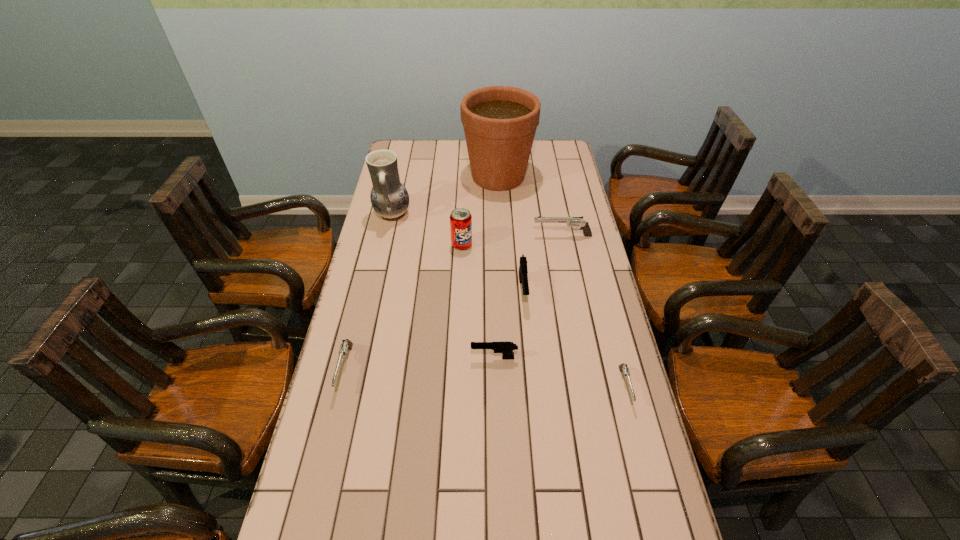
Where is `the left black pistol`? the left black pistol is located at coordinates (506, 348).

Image resolution: width=960 pixels, height=540 pixels. In order to click on the nearer black pistol in this screenshot , I will do `click(506, 348)`.

Find the location of a particular element. The width and height of the screenshot is (960, 540). the leftmost pistol is located at coordinates (346, 345).

Where is `the second smallest silver pistol`? the second smallest silver pistol is located at coordinates (346, 345).

The image size is (960, 540). Identify the location of the smallest silver pistol. (623, 367).

Locate an element on the screen. the shortest pistol is located at coordinates (623, 367).

What are the coordinates of `free spot located 0.130m on the right of the flowerpot` in the screenshot? It's located at (564, 177).

Find the location of a particular element. free location located on the right of the blue pottery is located at coordinates (471, 214).

This screenshot has height=540, width=960. Identify the location of blank space located 0.100m on the back of the red soda can. (463, 221).

You are a GUI agent. You are given a task and a screenshot of the screen. Output one action in this format:
    pyautogui.click(x=<x>, y=<y>)
    Task: Click on the vacant space located on the front-facing side of the right black pistol
    
    Given the screenshot: What is the action you would take?
    pyautogui.click(x=526, y=326)